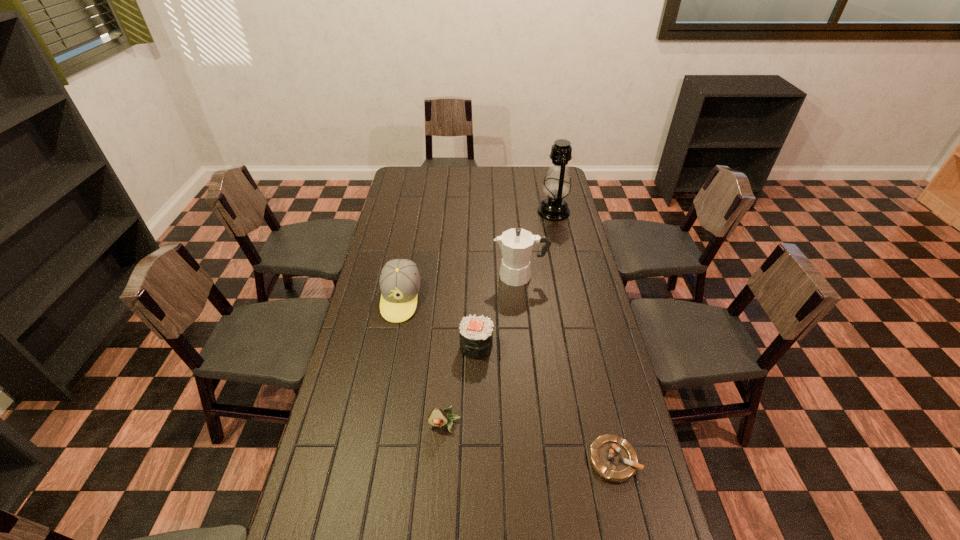
Locate an element on the screen. The height and width of the screenshot is (540, 960). vacant space that satisfies the following two spatial constraints: 1. on the front-facing side of the leftmost object; 2. on the left side of the sushi is located at coordinates (392, 346).

The image size is (960, 540). What are the coordinates of `blank space that satisfies the following two spatial constraints: 1. at the spout of the coffeepot; 2. on the left side of the shortest object` in the screenshot? It's located at (539, 460).

You are a GUI agent. You are given a task and a screenshot of the screen. Output one action in this format:
    pyautogui.click(x=<x>, y=<y>)
    Task: Click on the free space that satisfies the following two spatial constraints: 1. at the spout of the coffeepot; 2. on the front side of the third nearest object
    Image resolution: width=960 pixels, height=540 pixels.
    Given the screenshot: What is the action you would take?
    pyautogui.click(x=527, y=346)